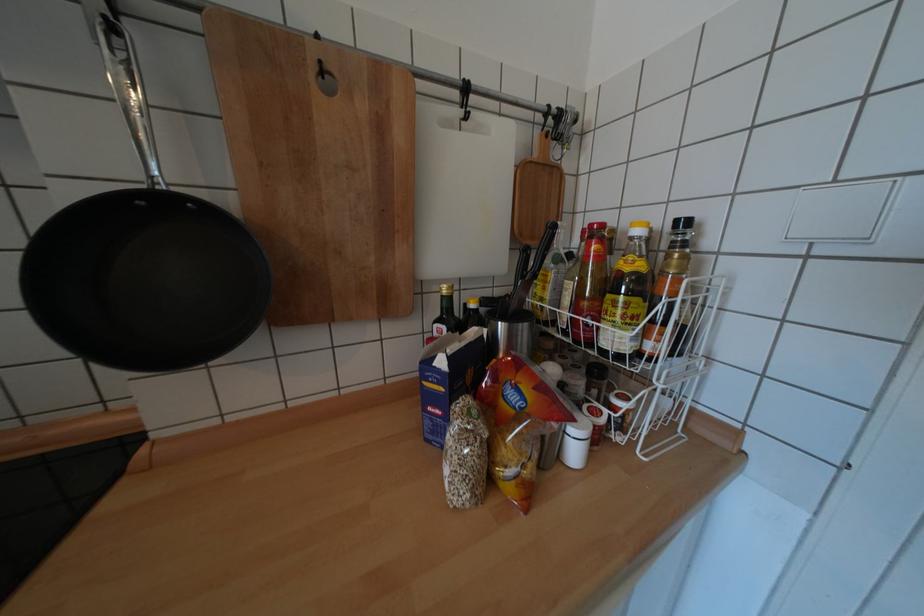
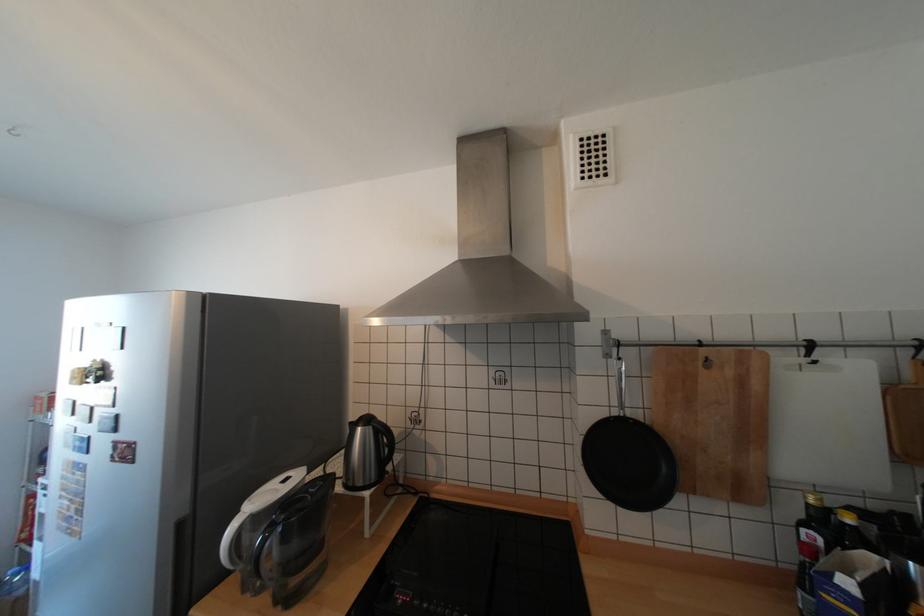
In the second image, find the point that corresponds to pixel 451 297 in the first image.

(817, 505)